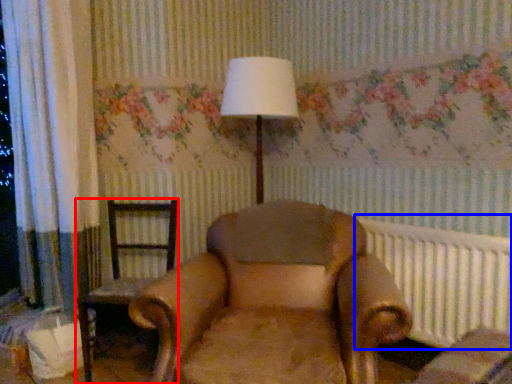
Question: Which object is further to the camera taking this photo, chair (highlighted by a red box) or radiator (highlighted by a blue box)?

Choices:
 (A) chair
 (B) radiator

Answer: (A)